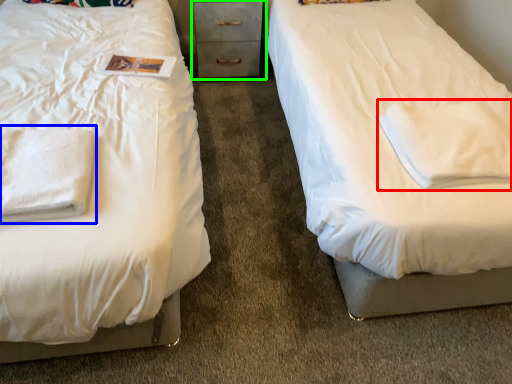
Question: Based on their relative distances, which object is farther from cloth (highlighted by a red box)? Choose from cloth (highlighted by a blue box) and chest of drawers (highlighted by a green box).

Choices:
 (A) cloth
 (B) chest of drawers

Answer: (B)